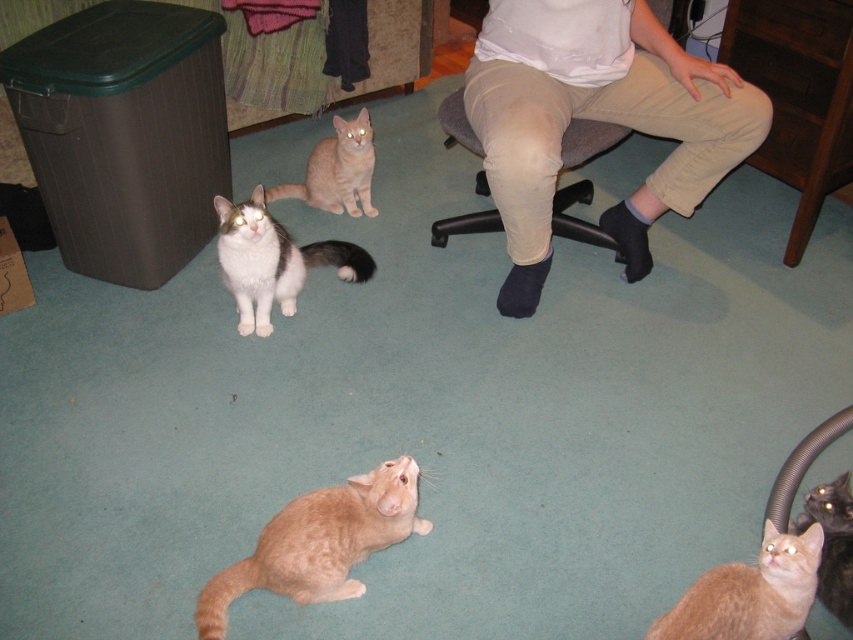
Looking at this image, does light beige pants at center appear on the left side of fluffy orange cat at lower right?

Indeed, light beige pants at center is positioned on the left side of fluffy orange cat at lower right.

Does light beige pants at center have a greater height compared to fluffy orange cat at lower right?

Yes, light beige pants at center is taller than fluffy orange cat at lower right.

Describe the element at coordinates (596, 120) in the screenshot. The height and width of the screenshot is (640, 853). I see `light beige pants at center` at that location.

Identify the location of light beige pants at center. Image resolution: width=853 pixels, height=640 pixels. (596, 120).

Is point (344, 552) farther from viewer compared to point (360, 132)?

That is False.

Can you confirm if fuzzy orange cat at lower center is bigger than orange fur cat at upper center?

No, fuzzy orange cat at lower center is not bigger than orange fur cat at upper center.

Which is behind, point (230, 589) or point (312, 198)?

Positioned behind is point (312, 198).

Find the location of a particular element. The image size is (853, 640). fuzzy orange cat at lower center is located at coordinates (318, 541).

Does point (312, 524) come farther from viewer compared to point (724, 620)?

Yes, it is behind point (724, 620).

From the picture: Does fuzzy orange cat at lower center have a larger size compared to orange fur cat at lower right?

Yes, fuzzy orange cat at lower center is bigger than orange fur cat at lower right.

Image resolution: width=853 pixels, height=640 pixels. Describe the element at coordinates (318, 541) in the screenshot. I see `fuzzy orange cat at lower center` at that location.

You are a GUI agent. You are given a task and a screenshot of the screen. Output one action in this format:
    pyautogui.click(x=<x>, y=<y>)
    Task: Click on the fuzzy orange cat at lower center
    The image size is (853, 640).
    Given the screenshot: What is the action you would take?
    pyautogui.click(x=318, y=541)